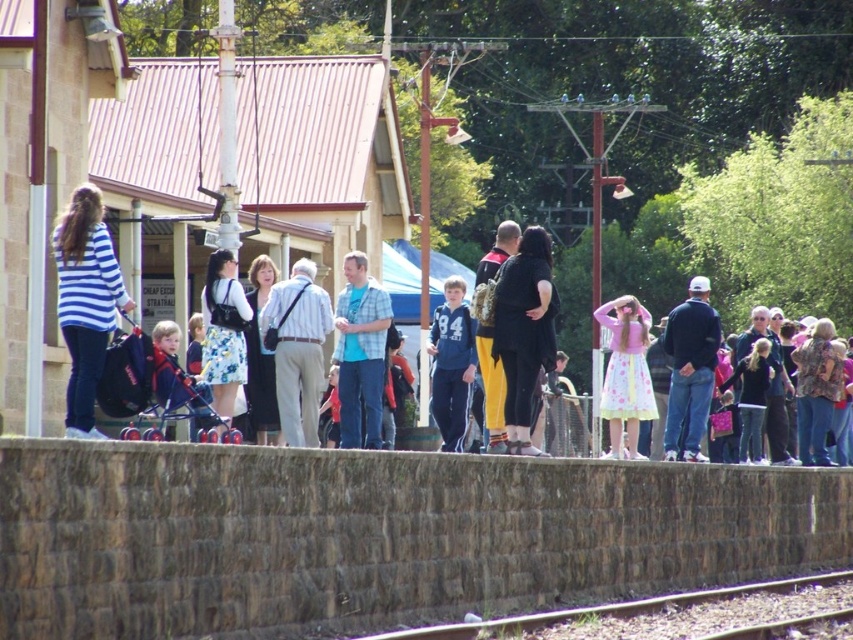
Does striped cotton shirt at left appear on the right side of black matte dress at center?

No, striped cotton shirt at left is not to the right of black matte dress at center.

Is striped cotton shirt at left positioned before black matte dress at center?

Yes.

Between point (71, 308) and point (541, 364), which one is positioned in front?

Point (71, 308) is in front.

Where is `striped cotton shirt at left`? striped cotton shirt at left is located at coordinates (86, 301).

Between point (248, 312) and point (457, 324), which one is positioned in front?

Point (248, 312)

Between floral fabric dress at center and blue fleece jacket at center, which one appears on the right side from the viewer's perspective?

blue fleece jacket at center

Between point (244, 320) and point (474, 355), which one is positioned in front?

Point (244, 320) is in front.

Where is `floral fabric dress at center`? floral fabric dress at center is located at coordinates (223, 332).

The width and height of the screenshot is (853, 640). Describe the element at coordinates (260, 356) in the screenshot. I see `matte black dress at center` at that location.

Who is more distant from viewer, (250, 410) or (479, 268)?

Point (250, 410)

Where is `matte black dress at center`? matte black dress at center is located at coordinates (260, 356).